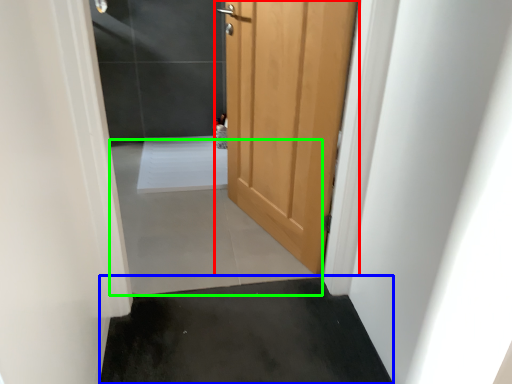
Question: Estimate the real-world distances between objects in this image. Which object is farther from door (highlighted by a red box), concrete (highlighted by a blue box) or concrete (highlighted by a green box)?

Choices:
 (A) concrete
 (B) concrete

Answer: (A)